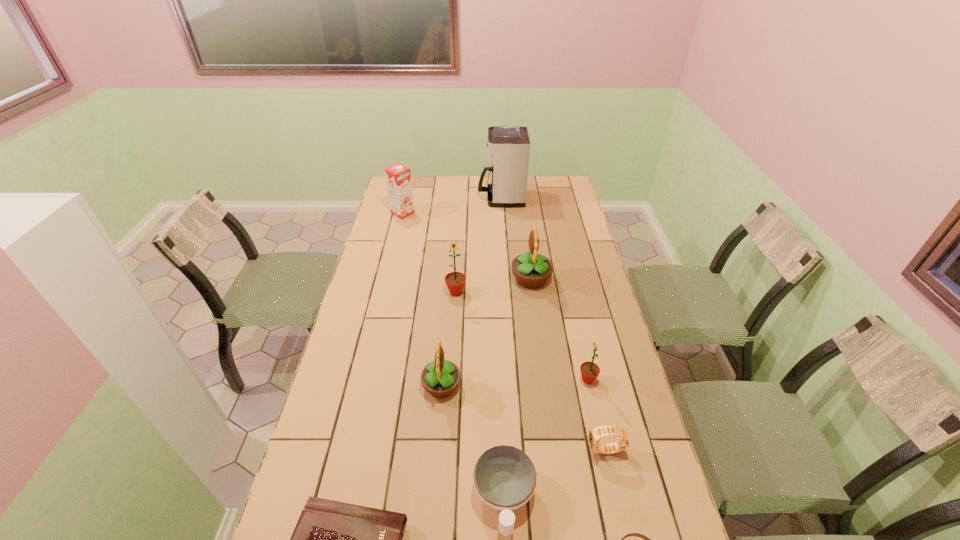
The width and height of the screenshot is (960, 540). I want to click on black watch, so click(595, 434).

Where is `free space located on the front panel of the tallest object`? Image resolution: width=960 pixels, height=540 pixels. free space located on the front panel of the tallest object is located at coordinates (462, 198).

Locate an element on the screen. free space located 0.120m on the front panel of the tallest object is located at coordinates (453, 198).

Where is `vacant space positioned 0.350m on the front panel of the tallest object`? The image size is (960, 540). vacant space positioned 0.350m on the front panel of the tallest object is located at coordinates (406, 198).

Locate an element on the screen. This screenshot has height=540, width=960. vacant space located 0.390m on the right of the carton is located at coordinates (498, 213).

The width and height of the screenshot is (960, 540). Find the location of `free space located on the face of the bigger yellow sunflower`. free space located on the face of the bigger yellow sunflower is located at coordinates [x=446, y=278].

Where is `vacant region located 0.290m on the face of the bigger yellow sunflower`? The width and height of the screenshot is (960, 540). vacant region located 0.290m on the face of the bigger yellow sunflower is located at coordinates (436, 278).

Find the location of a particular element. Image resolution: width=960 pixels, height=540 pixels. free spot located on the face of the bigger yellow sunflower is located at coordinates (469, 278).

The image size is (960, 540). In order to click on vacant space located 0.050m on the face of the farther green sunflower in this screenshot , I will do `click(455, 309)`.

I want to click on free space located 0.240m on the face of the smaller yellow sunflower, so click(540, 386).